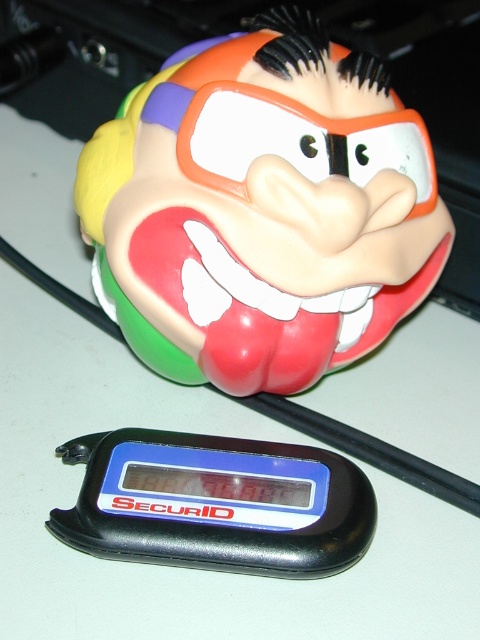
Question: Is rubber clown head at upper center bigger than black plastic securid at bottom?

Choices:
 (A) no
 (B) yes

Answer: (B)

Question: Which point appears farthest from the camera in this image?

Choices:
 (A) (251, 268)
 (B) (122, 436)

Answer: (B)

Question: Which of the following is the closest to the observer?

Choices:
 (A) (244, 563)
 (B) (159, 371)

Answer: (A)

Question: Can you confirm if rubber clown head at upper center is smaller than black plastic securid at bottom?

Choices:
 (A) yes
 (B) no

Answer: (B)

Question: Observing the image, what is the correct spatial positioning of rubber clown head at upper center in reference to black plastic securid at bottom?

Choices:
 (A) left
 (B) right

Answer: (B)